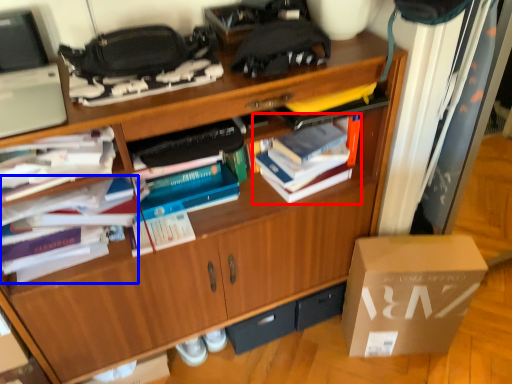
Question: Which point is further to the camera, book (highlighted by a red box) or book (highlighted by a blue box)?

Choices:
 (A) book
 (B) book

Answer: (A)